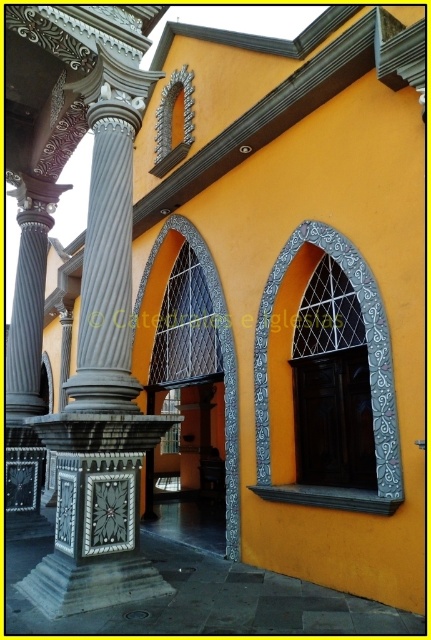
Question: Does silver textured frame at center appear over silver metallic archway at center?

Choices:
 (A) yes
 (B) no

Answer: (B)

Question: Which of the following is the farthest from the observer?

Choices:
 (A) (344, 492)
 (B) (236, 481)

Answer: (B)

Question: Does silver textured frame at center appear under silver metallic archway at center?

Choices:
 (A) no
 (B) yes

Answer: (B)

Question: Is the position of silver textured frame at center less distant than that of silver metallic archway at center?

Choices:
 (A) no
 (B) yes

Answer: (B)